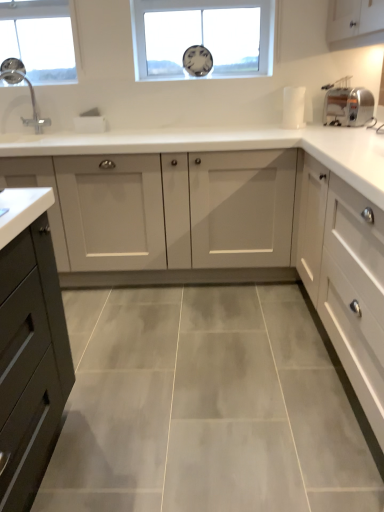
Question: Could you tell me if white glossy cabinet at center, positioned as the 2th cabinetry in front-to-back order, is facing white matte cabinet at right, the second cabinetry positioned from the back?

Choices:
 (A) yes
 (B) no

Answer: (A)

Question: Is white glossy cabinet at center, positioned as the 2th cabinetry in front-to-back order, wider than white matte cabinet at right, the first cabinetry positioned from the front?

Choices:
 (A) no
 (B) yes

Answer: (B)

Question: Can you confirm if white glossy cabinet at center, which ranks as the first cabinetry in back-to-front order, is smaller than white matte cabinet at right, the second cabinetry positioned from the back?

Choices:
 (A) yes
 (B) no

Answer: (B)

Question: Is white glossy cabinet at center, positioned as the 2th cabinetry in front-to-back order, bigger than white matte cabinet at right, the first cabinetry positioned from the front?

Choices:
 (A) yes
 (B) no

Answer: (A)

Question: Are white glossy cabinet at center, positioned as the 2th cabinetry in front-to-back order, and white matte cabinet at right, the second cabinetry positioned from the back, located far from each other?

Choices:
 (A) yes
 (B) no

Answer: (B)

Question: Is white glossy cabinet at center, which ranks as the first cabinetry in back-to-front order, shorter than white matte cabinet at right, the second cabinetry positioned from the back?

Choices:
 (A) yes
 (B) no

Answer: (B)

Question: Is satin silver toaster at right next to white glossy cabinet at center, positioned as the 2th cabinetry in front-to-back order?

Choices:
 (A) no
 (B) yes

Answer: (A)

Question: Is white glossy cabinet at center, which ranks as the first cabinetry in back-to-front order, surrounded by satin silver toaster at right?

Choices:
 (A) no
 (B) yes

Answer: (A)

Question: From the image's perspective, would you say satin silver toaster at right is shown under white glossy cabinet at center, positioned as the 2th cabinetry in front-to-back order?

Choices:
 (A) yes
 (B) no

Answer: (B)

Question: Is satin silver toaster at right not within white glossy cabinet at center, which ranks as the first cabinetry in back-to-front order?

Choices:
 (A) yes
 (B) no

Answer: (A)

Question: Considering the relative sizes of satin silver toaster at right and white glossy cabinet at center, positioned as the 2th cabinetry in front-to-back order, in the image provided, is satin silver toaster at right shorter than white glossy cabinet at center, positioned as the 2th cabinetry in front-to-back order,?

Choices:
 (A) no
 (B) yes

Answer: (B)

Question: Can you confirm if satin silver toaster at right is taller than white glossy cabinet at center, which ranks as the first cabinetry in back-to-front order?

Choices:
 (A) no
 (B) yes

Answer: (A)

Question: Is clear glass window at upper left, which ranks as the first window in left-to-right order, smaller than satin silver toaster at right?

Choices:
 (A) yes
 (B) no

Answer: (B)